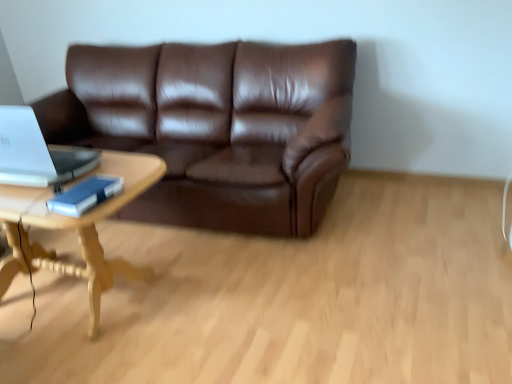
This screenshot has height=384, width=512. Find the location of `vacant space behind blue matte book at left`. vacant space behind blue matte book at left is located at coordinates (95, 178).